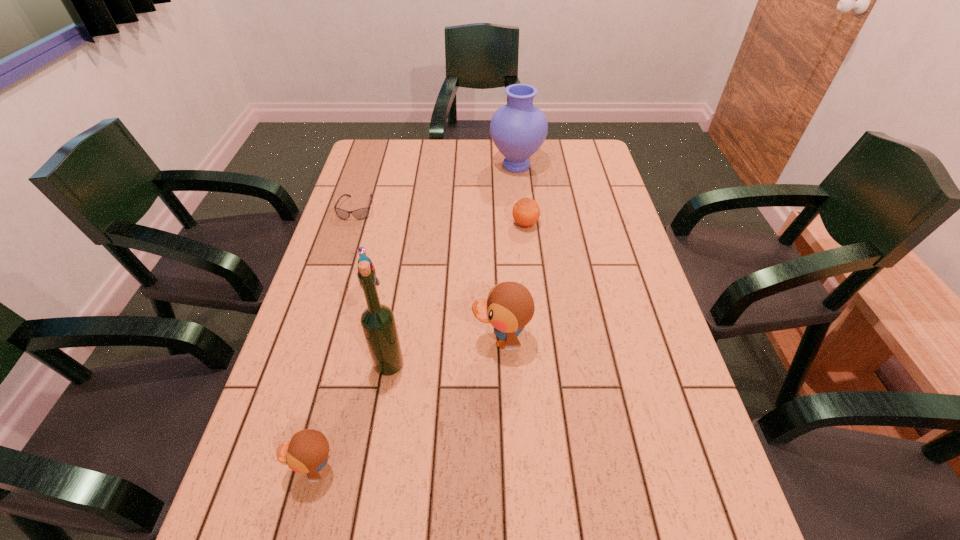
I want to click on vacant space located 0.220m on the front-facing side of the farther duck, so click(380, 340).

At what (x,y) coordinates should I click in order to perform the action: click on vacant space located on the front-facing side of the farther duck. Please return your answer as a coordinate pair (x, y). The height and width of the screenshot is (540, 960). Looking at the image, I should click on (385, 340).

Where is `free space located on the front-facing side of the farther duck`? The image size is (960, 540). free space located on the front-facing side of the farther duck is located at coordinates click(x=343, y=340).

Find the location of a particular element. The image size is (960, 540). free region located on the right of the sixth shortest object is located at coordinates [x=565, y=166].

You are a GUI agent. You are given a task and a screenshot of the screen. Output one action in this format:
    pyautogui.click(x=<x>, y=<y>)
    Task: Click on the vacant area situated on the lenses of the shortest object
    The width and height of the screenshot is (960, 540).
    Given the screenshot: What is the action you would take?
    pyautogui.click(x=342, y=254)

This screenshot has width=960, height=540. Identify the location of vacant point located 0.350m on the front of the orange. (537, 326).

Find the location of a particular element. free space located on the back of the soda is located at coordinates (386, 212).

Locate an element on the screen. The image size is (960, 540). vacant space located 0.200m on the right of the liquor is located at coordinates (492, 364).

Find the location of a particular element. object at the far edge is located at coordinates (518, 129).

The width and height of the screenshot is (960, 540). Identify the location of object at the near edge. (307, 451).